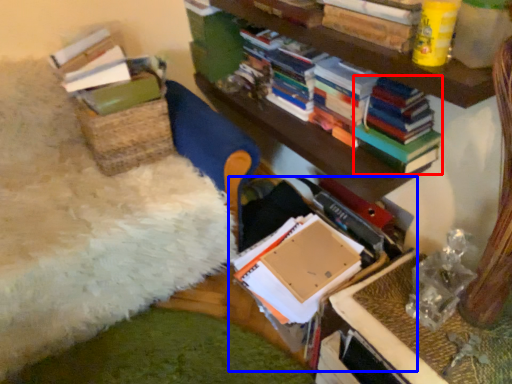
Question: Which of the following is the farthest to the observer, magazine (highlighted by a red box) or book (highlighted by a blue box)?

Choices:
 (A) magazine
 (B) book

Answer: (A)